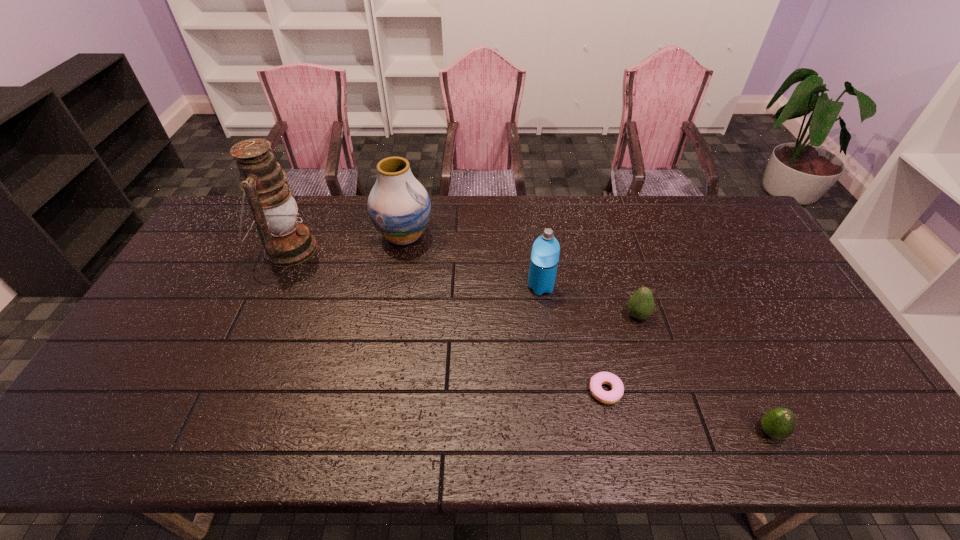
Locate an element on the screen. The image size is (960, 540). object that is positioned at the near edge is located at coordinates (779, 423).

You are a GUI agent. You are given a task and a screenshot of the screen. Output one action in this format:
    pyautogui.click(x=<x>, y=<y>)
    Task: Click on the vacant space at the far edge
    
    Given the screenshot: What is the action you would take?
    pyautogui.click(x=556, y=235)

Identify the location of free space at the near edge of the desktop. The image size is (960, 540). (432, 425).

The height and width of the screenshot is (540, 960). In the image, there is a desktop. What are the coordinates of `vacant space at the right edge` in the screenshot? It's located at (765, 306).

Where is `vacant space at the far left corner of the desktop`? vacant space at the far left corner of the desktop is located at coordinates (207, 236).

In the image, there is a desktop. Find the location of `vacant region at the far right corner`. vacant region at the far right corner is located at coordinates (722, 213).

The width and height of the screenshot is (960, 540). In order to click on vacant point located between the vase and the leftmost object in this screenshot , I will do `click(347, 243)`.

Identify the location of empty space that is in between the vase and the rightmost object. The width and height of the screenshot is (960, 540). (588, 334).

Find the location of a particular element. This screenshot has height=540, width=960. vacant area between the farther avocado and the fifth shortest object is located at coordinates (520, 276).

Locate an element on the screen. The width and height of the screenshot is (960, 540). unoccupied position between the doughnut and the thermos bottle is located at coordinates (573, 339).